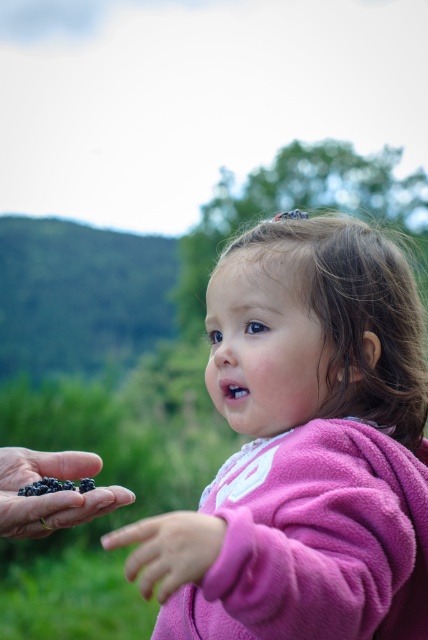
Question: Is pink fleece jacket at center smaller than black matte berries at lower left?

Choices:
 (A) no
 (B) yes

Answer: (A)

Question: Estimate the real-world distances between objects in this image. Which object is closer to the pink fleece jacket at center?

Choices:
 (A) blueberry-like berries at lower left
 (B) pink fleece hand at lower center
 (C) black matte berries at lower left

Answer: (C)

Question: Which is nearer to the black matte berries at lower left?

Choices:
 (A) pink fleece jacket at center
 (B) pink fleece hand at lower center
 (C) blueberry-like berries at lower left

Answer: (C)

Question: Which point appears farthest from the camera in this image?

Choices:
 (A) (303, 288)
 (B) (47, 488)
 (C) (50, 522)

Answer: (A)

Question: Can you confirm if pink fleece jacket at center is wider than pink fleece hand at lower center?

Choices:
 (A) no
 (B) yes

Answer: (B)

Question: Is pink fleece jacket at center behind pink fleece hand at lower center?

Choices:
 (A) yes
 (B) no

Answer: (B)